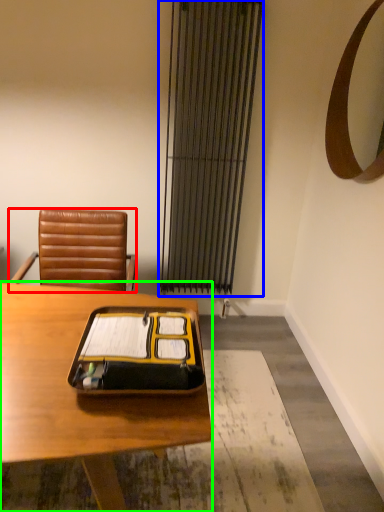
Question: Estimate the real-world distances between objects in this image. Which object is closer to chair (highlighted by a red box), curtain (highlighted by a blue box) or desk (highlighted by a green box)?

Choices:
 (A) curtain
 (B) desk

Answer: (B)